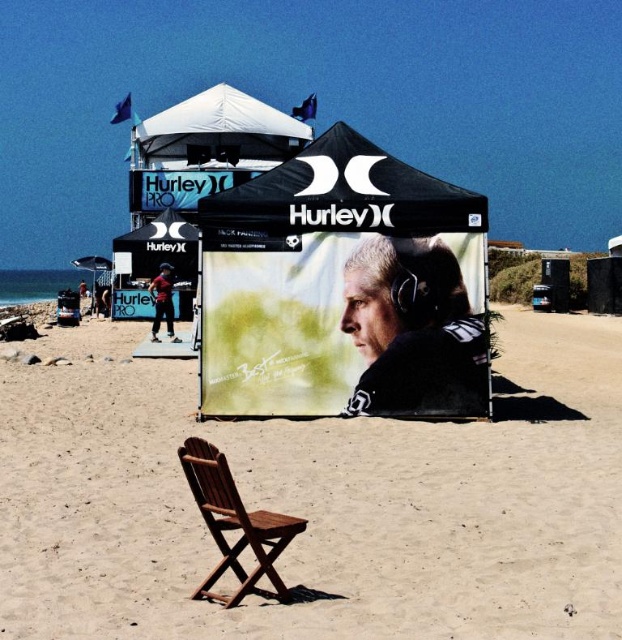
Question: Does smooth sand at center appear under white fabric canopy at upper center?

Choices:
 (A) no
 (B) yes

Answer: (B)

Question: Considering the relative positions of smooth skin portrait at center and white fabric canopy at upper center in the image provided, where is smooth skin portrait at center located with respect to white fabric canopy at upper center?

Choices:
 (A) below
 (B) above

Answer: (A)

Question: Among these points, which one is farthest from the camera?

Choices:
 (A) pos(361,376)
 (B) pos(295,141)
 (C) pos(243,573)

Answer: (B)

Question: Which object appears closest to the camera in this image?

Choices:
 (A) blue denim jeans at center
 (B) smooth sand at center
 (C) black matte tent at center

Answer: (B)

Question: Which object is closer to the camera taking this photo?

Choices:
 (A) wooden chair at center
 (B) white fabric canopy at upper center

Answer: (A)

Question: Can you confirm if smooth sand at center is thinner than wooden chair at center?

Choices:
 (A) yes
 (B) no

Answer: (B)